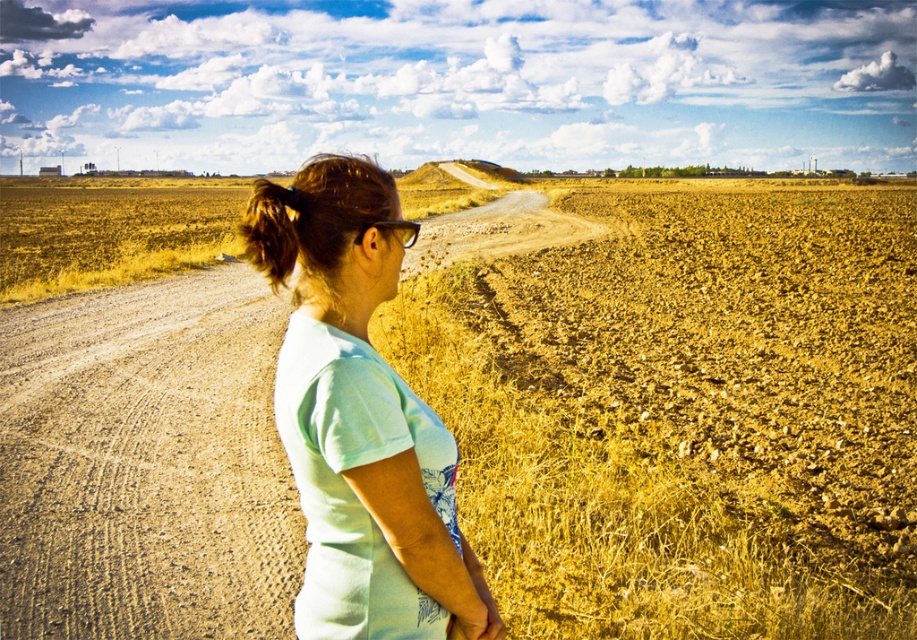
Is brown gravel dirt track at left shorter than brown hair at left?

No, brown gravel dirt track at left is not shorter than brown hair at left.

Who is more forward, (x=177, y=588) or (x=278, y=280)?

Point (x=278, y=280) is in front.

You are a GUI agent. You are given a task and a screenshot of the screen. Output one action in this format:
    pyautogui.click(x=<x>, y=<y>)
    Task: Click on the brown gravel dirt track at left
    
    Given the screenshot: What is the action you would take?
    pyautogui.click(x=146, y=464)

Is brown gravel dirt track at left closer to the viewer compared to light blue t-shirt at center?

No, it is behind light blue t-shirt at center.

Can you confirm if brown gravel dirt track at left is positioned above light blue t-shirt at center?

No.

Who is more forward, (21, 410) or (284, 202)?

Point (284, 202)

Where is `brown gravel dirt track at left`? The width and height of the screenshot is (917, 640). brown gravel dirt track at left is located at coordinates (146, 464).

Does point (315, 193) come behind point (412, 230)?

No.

Does light blue t-shirt at center appear under black plastic glasses at center?

Correct, light blue t-shirt at center is located below black plastic glasses at center.

Measure the distance between point [399,536] and camera.

Point [399,536] and camera are 1.42 meters apart from each other.

Locate an element on the screen. The width and height of the screenshot is (917, 640). light blue t-shirt at center is located at coordinates (359, 420).